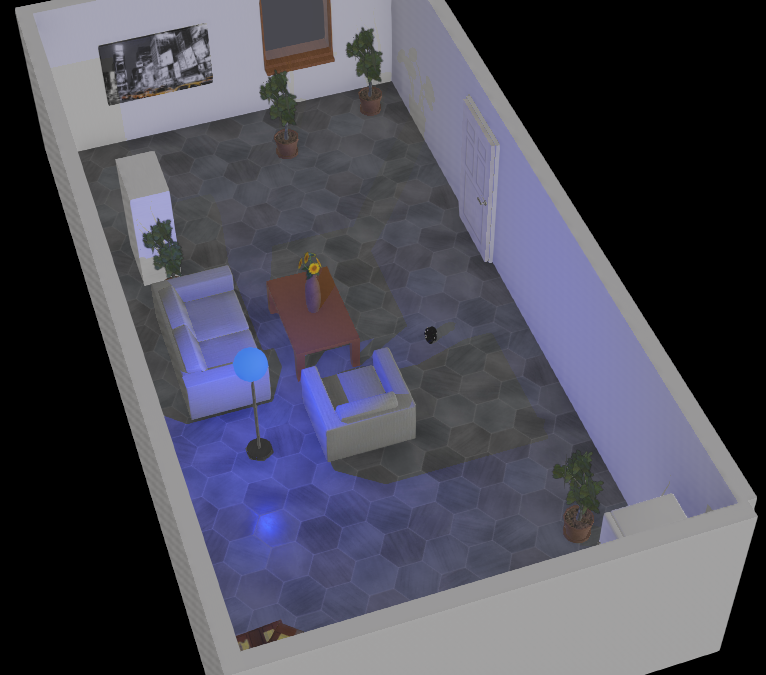
Find the location of `artwork on wall`. artwork on wall is located at coordinates (152, 65).